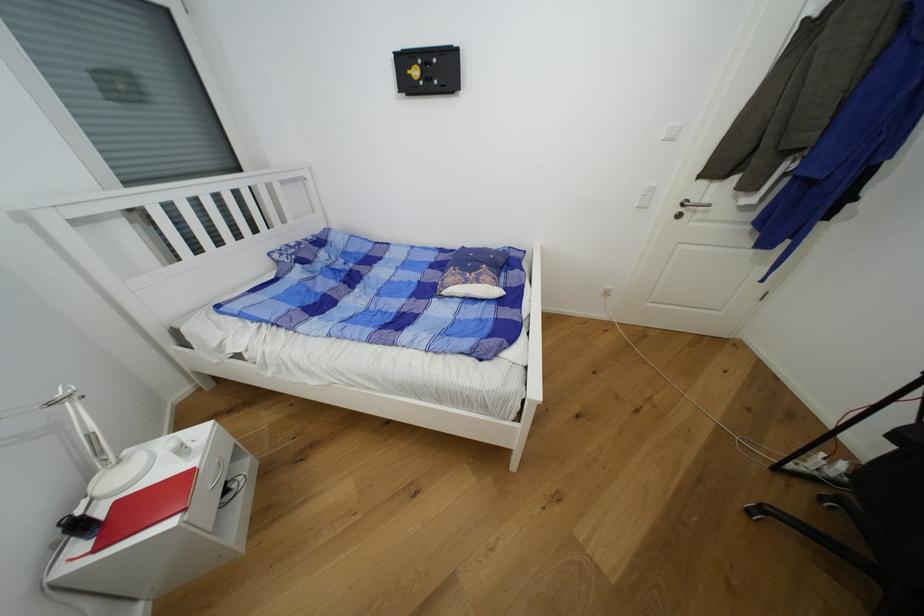
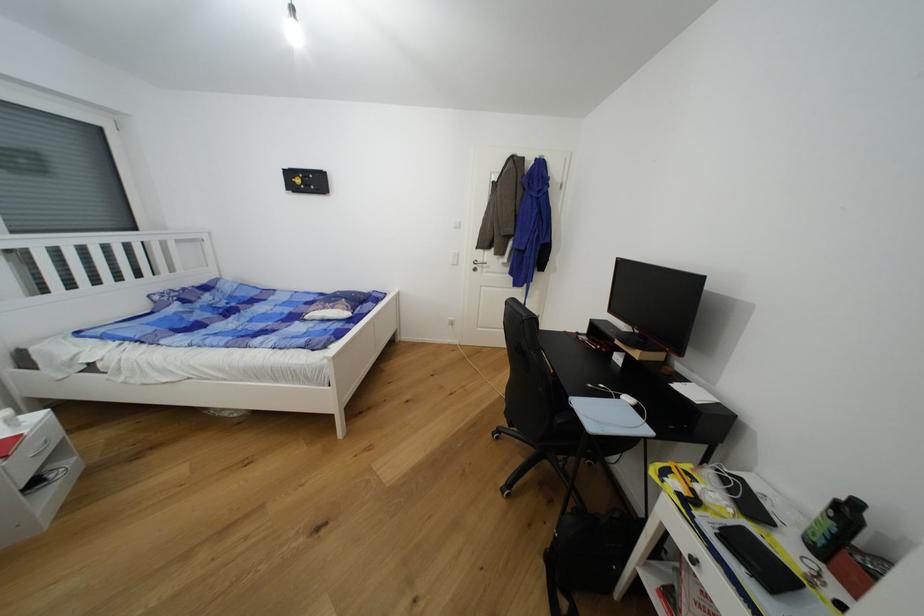
In the second image, find the point that corresponds to (x=281, y=257) in the first image.

(162, 299)